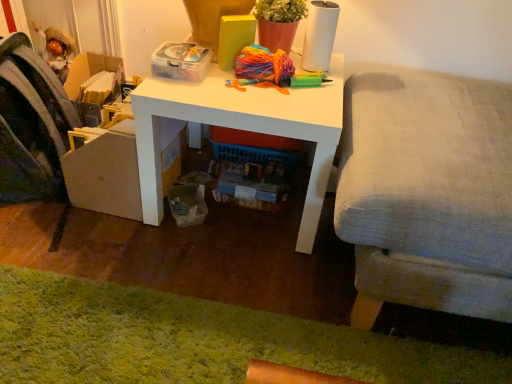
Measure the distance between point [289,130] and camera.

The depth of point [289,130] is 3.57 feet.

Measure the distance between point (201,381) and camera.

The distance of point (201,381) from camera is 38.11 inches.

Where is `light gray fabric couch at right`? This screenshot has width=512, height=384. light gray fabric couch at right is located at coordinates (426, 193).

What is the approximate height of velvet fabric swivel chair at left?

velvet fabric swivel chair at left is 19.35 inches in height.

This screenshot has height=384, width=512. Identify the location of white matte desk at center. (242, 128).

Does transparent plastic storage box at upper center have a larger size compared to green shaggy rug at lower left?

No.

Is transparent plastic storage box at upper center situated inside green shaggy rug at lower left or outside?

transparent plastic storage box at upper center is not inside green shaggy rug at lower left, it's outside.

Is transparent plastic storage box at upper center positioned far away from green shaggy rug at lower left?

No, transparent plastic storage box at upper center is in close proximity to green shaggy rug at lower left.

Is point (163, 54) positioned behind point (354, 330)?

Yes, point (163, 54) is farther from viewer.

In the scene shown: From the image's perspective, does white matte desk at center appear lower than green shaggy rug at lower left?

Actually, white matte desk at center appears above green shaggy rug at lower left in the image.

Looking at the image, does white matte desk at center seem bigger or smaller compared to green shaggy rug at lower left?

In the image, white matte desk at center appears to be larger than green shaggy rug at lower left.

Is white matte desk at center facing away from green shaggy rug at lower left?

No, green shaggy rug at lower left is not at the back of white matte desk at center.

Is velvet fabric swivel chair at left facing away from light gray fabric couch at right?

No, light gray fabric couch at right is not at the back of velvet fabric swivel chair at left.

Looking at their sizes, would you say velvet fabric swivel chair at left is wider or thinner than light gray fabric couch at right?

velvet fabric swivel chair at left is thinner than light gray fabric couch at right.

Locate an element on the screen. The height and width of the screenshot is (384, 512). studio couch below the velvet fabric swivel chair at left (from the image's perspective) is located at coordinates (426, 193).

Is light gray fabric couch at right taller than green shaggy rug at lower left?

Correct, light gray fabric couch at right is much taller as green shaggy rug at lower left.

From the image's perspective, is light gray fabric couch at right under green shaggy rug at lower left?

No, from the image's perspective, light gray fabric couch at right is not below green shaggy rug at lower left.

Can you tell me how much light gray fabric couch at right and green shaggy rug at lower left differ in facing direction?

There is a 90-degree angle between the facing directions of light gray fabric couch at right and green shaggy rug at lower left.

Is white matte desk at center smaller than light gray fabric couch at right?

Indeed, white matte desk at center has a smaller size compared to light gray fabric couch at right.

Would you consider white matte desk at center to be distant from light gray fabric couch at right?

That's not correct — white matte desk at center is a little close to light gray fabric couch at right.

Locate an element on the screen. Image resolution: width=512 pixels, height=384 pixels. studio couch to the right of white matte desk at center is located at coordinates (426, 193).

From the picture: Considering the positions of objects velvet fabric swivel chair at left and white matte desk at center in the image provided, who is more to the right, velvet fabric swivel chair at left or white matte desk at center?

Positioned to the right is white matte desk at center.

Which object is wider, velvet fabric swivel chair at left or white matte desk at center?

white matte desk at center is wider.

Is velvet fabric swivel chair at left directly adjacent to white matte desk at center?

There is a gap between velvet fabric swivel chair at left and white matte desk at center.

From a real-world perspective, is velvet fabric swivel chair at left beneath green shaggy rug at lower left?

No, from a real-world perspective, velvet fabric swivel chair at left is not below green shaggy rug at lower left.

Is velvet fabric swivel chair at left completely or partially outside of green shaggy rug at lower left?

Yes, velvet fabric swivel chair at left is located beyond the bounds of green shaggy rug at lower left.

Considering the relative sizes of velvet fabric swivel chair at left and green shaggy rug at lower left in the image provided, is velvet fabric swivel chair at left thinner than green shaggy rug at lower left?

No, velvet fabric swivel chair at left is not thinner than green shaggy rug at lower left.

Where is `storage box on the left of the green shaggy rug at lower left`? storage box on the left of the green shaggy rug at lower left is located at coordinates (181, 61).

Locate an element on the screen. desk above the green shaggy rug at lower left (from the image's perspective) is located at coordinates (242, 128).

In the scene shown: Looking at the image, which one is located closer to green shaggy rug at lower left, transparent plastic storage box at upper center or light gray fabric couch at right?

light gray fabric couch at right lies closer to green shaggy rug at lower left than the other object.

When comparing their distances from white matte desk at center, does velvet fabric swivel chair at left or green shaggy rug at lower left seem closer?

green shaggy rug at lower left lies closer to white matte desk at center than the other object.

When comparing their distances from velvet fabric swivel chair at left, does green shaggy rug at lower left or white matte desk at center seem closer?

white matte desk at center is closer to velvet fabric swivel chair at left.

Estimate the real-world distances between objects in this image. Which object is closer to green shaggy rug at lower left, velvet fabric swivel chair at left or transparent plastic storage box at upper center?

velvet fabric swivel chair at left is positioned closer to the anchor green shaggy rug at lower left.

From the image, which object appears to be nearer to light gray fabric couch at right, white matte desk at center or green shaggy rug at lower left?

The object closer to light gray fabric couch at right is white matte desk at center.

When comparing their distances from green shaggy rug at lower left, does velvet fabric swivel chair at left or light gray fabric couch at right seem closer?

Among the two, light gray fabric couch at right is located nearer to green shaggy rug at lower left.

When comparing their distances from white matte desk at center, does light gray fabric couch at right or green shaggy rug at lower left seem closer?

→ light gray fabric couch at right lies closer to white matte desk at center than the other object.

Consider the image. Estimate the real-world distances between objects in this image. Which object is further from transparent plastic storage box at upper center, light gray fabric couch at right or green shaggy rug at lower left?

green shaggy rug at lower left.

Locate an element on the screen. desk between transparent plastic storage box at upper center and green shaggy rug at lower left vertically is located at coordinates (242, 128).

Where is `desk between green shaggy rug at lower left and light gray fabric couch at right`? Image resolution: width=512 pixels, height=384 pixels. desk between green shaggy rug at lower left and light gray fabric couch at right is located at coordinates (242, 128).

Identify the location of desk between transparent plastic storage box at upper center and light gray fabric couch at right from left to right. The height and width of the screenshot is (384, 512). (242, 128).

The height and width of the screenshot is (384, 512). I want to click on mat between velvet fabric swivel chair at left and white matte desk at center in the horizontal direction, so click(196, 340).